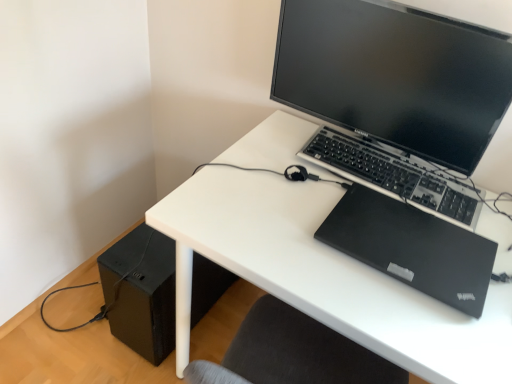
Question: Is black plastic keyboard at center oriented towards matte black monitor at upper center?

Choices:
 (A) no
 (B) yes

Answer: (B)

Question: Considering the relative positions of black plastic keyboard at center and matte black monitor at upper center in the image provided, is black plastic keyboard at center in front of matte black monitor at upper center?

Choices:
 (A) no
 (B) yes

Answer: (A)

Question: Is the depth of black plastic keyboard at center greater than that of matte black monitor at upper center?

Choices:
 (A) yes
 (B) no

Answer: (A)

Question: Does black plastic keyboard at center appear on the right side of matte black monitor at upper center?

Choices:
 (A) no
 (B) yes

Answer: (B)

Question: Are black plastic keyboard at center and matte black monitor at upper center beside each other?

Choices:
 (A) no
 (B) yes

Answer: (A)

Question: Considering their positions, is matte black monitor at upper center located in front of or behind black plastic keyboard at center?

Choices:
 (A) behind
 (B) front

Answer: (B)

Question: From their relative heights in the image, would you say matte black monitor at upper center is taller or shorter than black plastic keyboard at center?

Choices:
 (A) tall
 (B) short

Answer: (A)

Question: From the image's perspective, is matte black monitor at upper center above or below black plastic keyboard at center?

Choices:
 (A) above
 (B) below

Answer: (A)

Question: From a real-world perspective, relative to black plastic keyboard at center, is matte black monitor at upper center vertically above or below?

Choices:
 (A) above
 (B) below

Answer: (A)

Question: Considering their positions, is black matte speaker at lower left located in front of or behind black matte laptop at upper right?

Choices:
 (A) behind
 (B) front

Answer: (A)

Question: From a real-world perspective, relative to black matte laptop at upper right, is black matte speaker at lower left vertically above or below?

Choices:
 (A) above
 (B) below

Answer: (B)

Question: From the image's perspective, is black matte speaker at lower left located above or below black matte laptop at upper right?

Choices:
 (A) above
 (B) below

Answer: (B)

Question: Does point (126, 327) appear closer or farther from the camera than point (400, 244)?

Choices:
 (A) closer
 (B) farther

Answer: (B)

Question: In the image, is white matte desk at center positioned in front of or behind black plastic keyboard at center?

Choices:
 (A) behind
 (B) front

Answer: (B)

Question: Would you say white matte desk at center is inside or outside black plastic keyboard at center?

Choices:
 (A) inside
 (B) outside

Answer: (B)